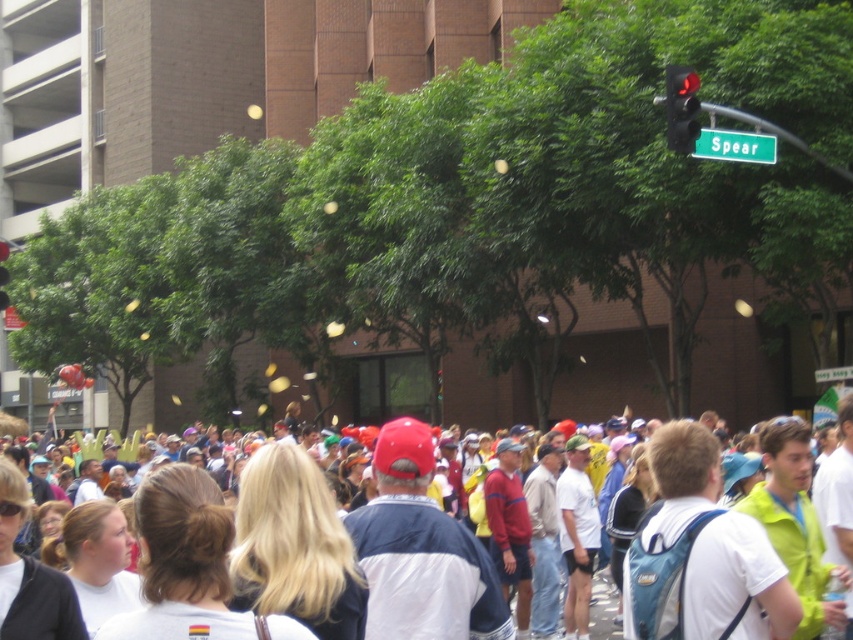
Based on the photo, you are standing at the point marked by the coordinates point (602, 614). Looking around, you see the white cotton crowd at center. Which direction should you move to get closer to the white cotton crowd at center?

Since you are already at the point representing the white cotton crowd at center, you are already in the middle of the crowd.

You are a drone operator trying to capture aerial footage of the white cotton crowd at center and the red glass traffic light at upper right. From your current position, which object is above the other?

The red glass traffic light at upper right is positioned over the white cotton crowd at center, so the traffic light is above the crowd.

You are a photographer trying to capture a clear shot of the metallic red traffic light at upper right. However, the white cotton crowd at center is blocking your view. Based on their positions, which direction should you move to get an unobstructed view of the traffic light?

The white cotton crowd at center is positioned on the right side of the metallic red traffic light at upper right. To get an unobstructed view, you should move to the left side of the traffic light, away from the crowd.